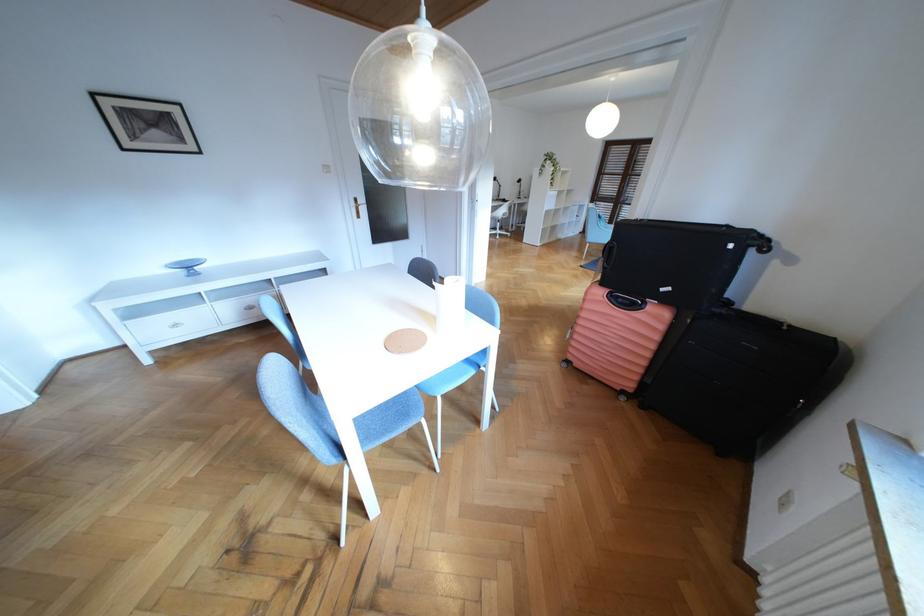
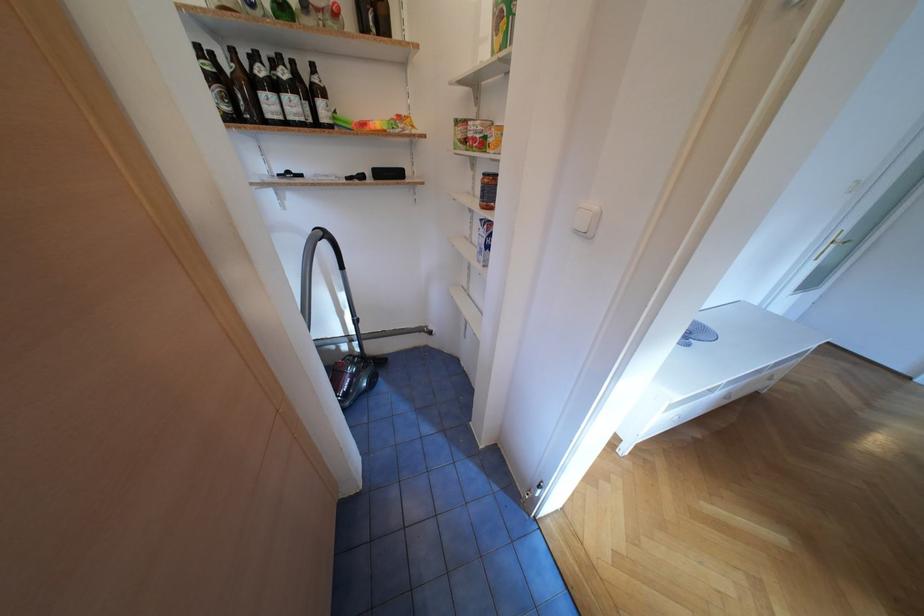
Question: What movement of the cameraman would produce the second image?

Choices:
 (A) Left
 (B) Right
 (C) Forward
 (D) Backward

Answer: (A)